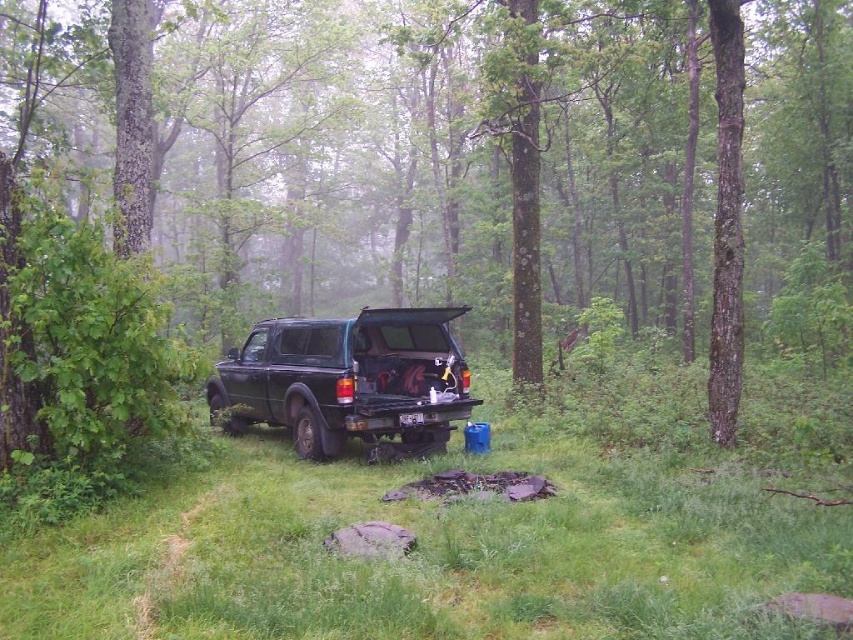
Does point (228, 211) lie in front of point (456, 358)?

That is False.

Between green leafy tree at center and matte black truck at center, which one has less height?

matte black truck at center is shorter.

Does point (221, 10) come closer to viewer compared to point (375, 433)?

That is False.

Find the location of a particular element. green leafy tree at center is located at coordinates (461, 148).